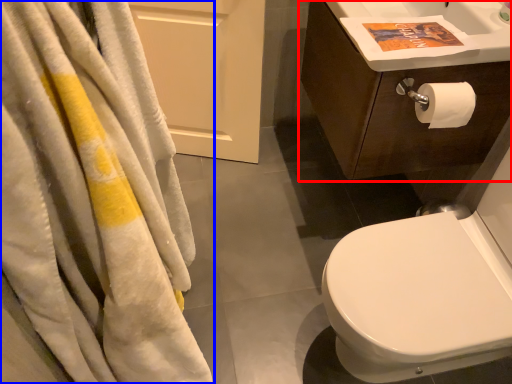
Question: Which object appears closest to the camera in this image, bathroom cabinet (highlighted by a red box) or towel (highlighted by a blue box)?

Choices:
 (A) bathroom cabinet
 (B) towel

Answer: (B)